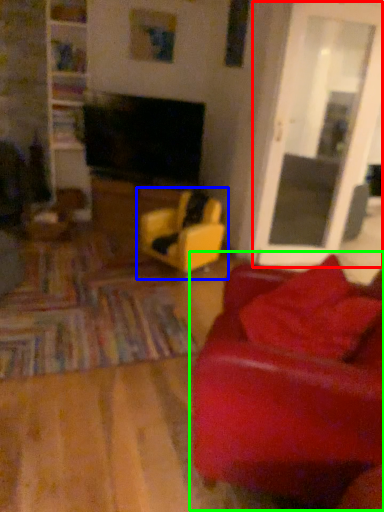
Question: Which object is the closest to the glass door (highlighted by a red box)? Choose among these: chair (highlighted by a blue box) or studio couch (highlighted by a green box).

Choices:
 (A) chair
 (B) studio couch

Answer: (A)